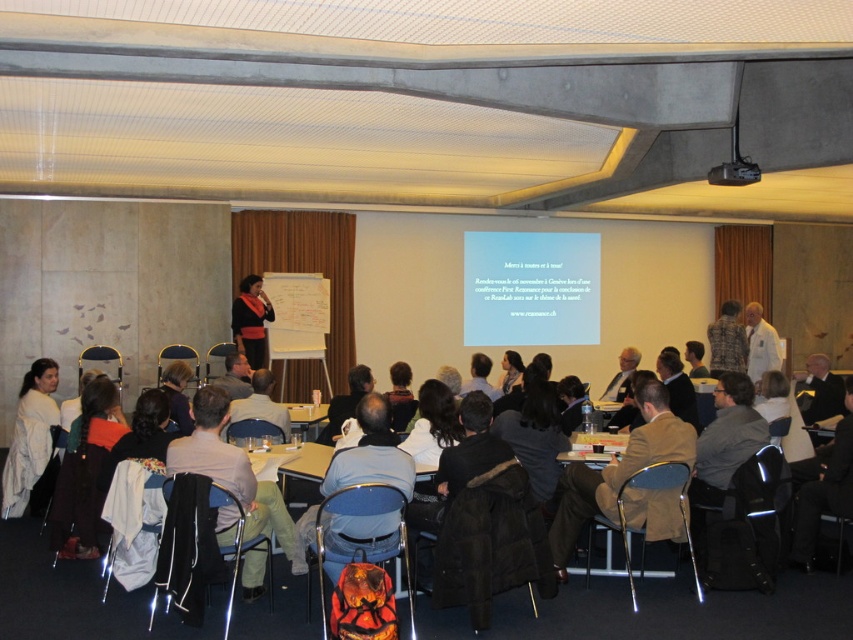
You are an event organizer who needs to ensure that the blue fabric jacket at center and the black plastic projector at upper center are visible to all attendees. Based on their positions, which object is closer to the front of the room?

The blue fabric jacket at center is positioned under the black plastic projector at upper center, meaning it is closer to the front of the room compared to the projector.